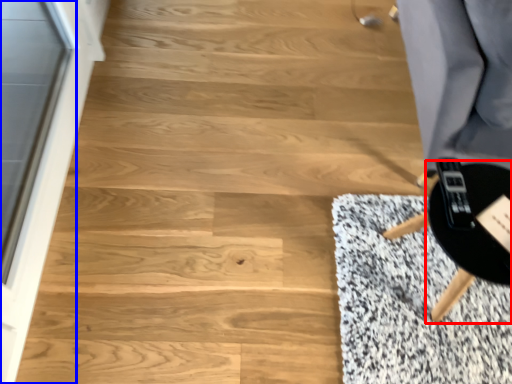
Question: Which object is further to the camera taking this photo, round table (highlighted by a red box) or screen door (highlighted by a blue box)?

Choices:
 (A) round table
 (B) screen door

Answer: (A)